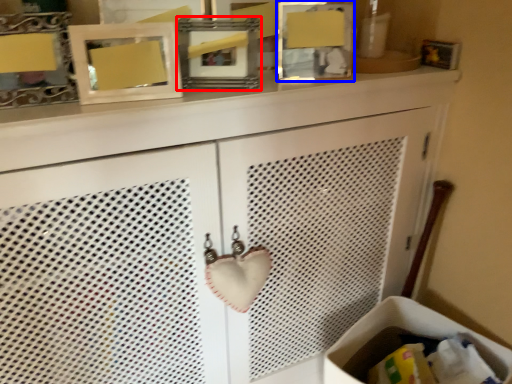
Question: Which object is closer to the camera taking this photo, picture frame (highlighted by a red box) or picture frame (highlighted by a blue box)?

Choices:
 (A) picture frame
 (B) picture frame

Answer: (A)